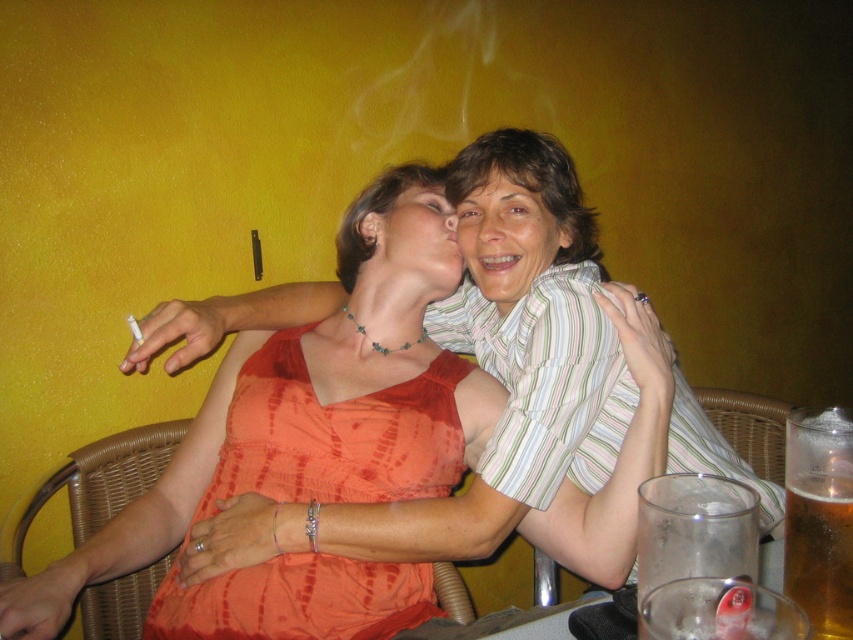
Question: Among these objects, which one is farthest from the camera?

Choices:
 (A) translucent glass beer at lower right
 (B) matte white face at center
 (C) matte striped shirt at upper center

Answer: (B)

Question: From the image, what is the correct spatial relationship of orange fabric dress at center in relation to translucent glass beer at lower right?

Choices:
 (A) right
 (B) left

Answer: (B)

Question: Observing the image, what is the correct spatial positioning of orange fabric dress at center in reference to matte white face at center?

Choices:
 (A) left
 (B) right

Answer: (B)

Question: Which of these objects is positioned closest to the matte white face at center?

Choices:
 (A) orange fabric dress at center
 (B) matte striped shirt at upper center

Answer: (B)

Question: Which object is farther from the camera taking this photo?

Choices:
 (A) matte striped shirt at upper center
 (B) matte white face at center
 (C) orange fabric dress at center

Answer: (B)

Question: Is translucent glass beer at lower right below matte striped shirt at upper center?

Choices:
 (A) no
 (B) yes

Answer: (B)